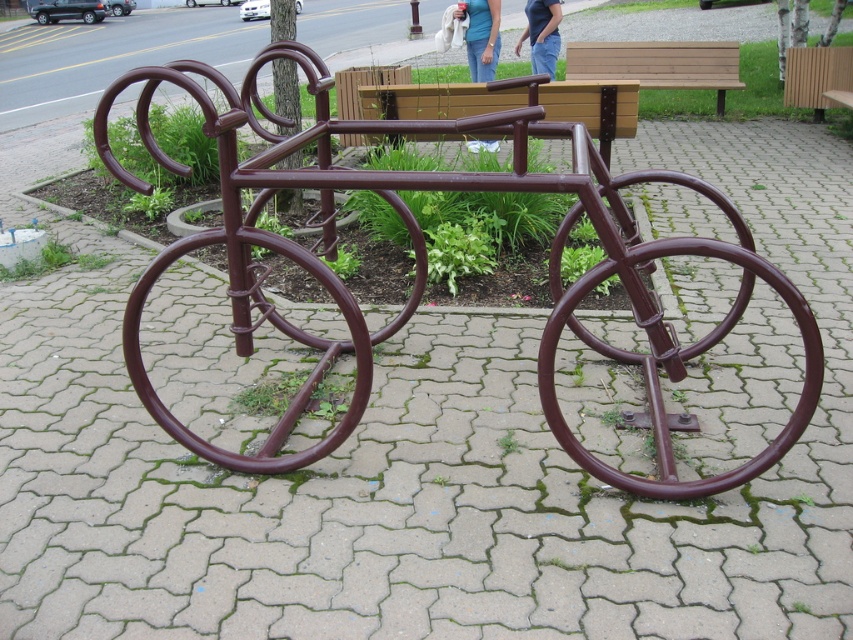
Between point (561, 305) and point (607, 128), which one is positioned behind?

Positioned behind is point (607, 128).

Is brown metallic bicycle at center wider than brown wood bench at center?

Indeed, brown metallic bicycle at center has a greater width compared to brown wood bench at center.

Does point (113, 83) come farther from viewer compared to point (376, 113)?

Yes, it is.

Locate an element on the screen. The width and height of the screenshot is (853, 640). brown metallic bicycle at center is located at coordinates (424, 264).

Who is more distant from viewer, (399, 109) or (555, 1)?

Point (555, 1)

Is brown wood bench at center closer to the viewer compared to blue jeans at upper center?

That is True.

Is point (604, 132) farther from viewer compared to point (535, 36)?

No, it is not.

Identify the location of brown wood bench at center. (514, 104).

Can you confirm if brown wooden bench at upper right is positioned below blue jeans at upper center?

Yes, brown wooden bench at upper right is below blue jeans at upper center.

Locate an element on the screen. Image resolution: width=853 pixels, height=640 pixels. brown wooden bench at upper right is located at coordinates (816, 76).